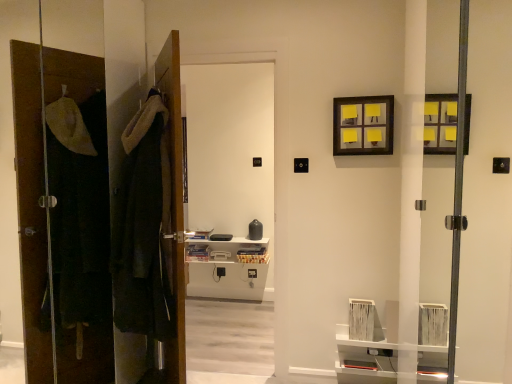
Question: Does velvet-like dark green robe at left have a lesser width compared to white glossy door at center?

Choices:
 (A) yes
 (B) no

Answer: (B)

Question: Can you confirm if velvet-like dark green robe at left is bigger than white glossy door at center?

Choices:
 (A) no
 (B) yes

Answer: (A)

Question: Would you say velvet-like dark green robe at left is outside white glossy door at center?

Choices:
 (A) no
 (B) yes

Answer: (B)

Question: From a real-world perspective, is velvet-like dark green robe at left under white glossy door at center?

Choices:
 (A) yes
 (B) no

Answer: (A)

Question: Considering the relative positions of velvet-like dark green robe at left and white glossy door at center in the image provided, is velvet-like dark green robe at left behind white glossy door at center?

Choices:
 (A) yes
 (B) no

Answer: (B)

Question: In terms of height, does brown wooden door at left, marked as the first door in a left-to-right arrangement, look taller or shorter compared to wooden door at center, marked as the 2th door in a left-to-right arrangement?

Choices:
 (A) short
 (B) tall

Answer: (B)

Question: Looking at the image, does brown wooden door at left, marked as the first door in a left-to-right arrangement, seem bigger or smaller compared to wooden door at center, acting as the 1th door starting from the right?

Choices:
 (A) small
 (B) big

Answer: (B)

Question: Which is correct: brown wooden door at left, which appears as the second door when viewed from the right, is inside wooden door at center, acting as the 1th door starting from the right, or outside of it?

Choices:
 (A) inside
 (B) outside

Answer: (B)

Question: Looking at their shapes, would you say brown wooden door at left, which appears as the second door when viewed from the right, is wider or thinner than wooden door at center, marked as the 2th door in a left-to-right arrangement?

Choices:
 (A) wide
 (B) thin

Answer: (B)

Question: From the image's perspective, is matte black picture frame at upper right above or below brown wooden door at left, marked as the first door in a left-to-right arrangement?

Choices:
 (A) above
 (B) below

Answer: (A)

Question: Visually, is matte black picture frame at upper right positioned to the left or to the right of brown wooden door at left, which appears as the second door when viewed from the right?

Choices:
 (A) left
 (B) right

Answer: (B)

Question: In the image, is matte black picture frame at upper right positioned in front of or behind brown wooden door at left, marked as the first door in a left-to-right arrangement?

Choices:
 (A) behind
 (B) front

Answer: (A)

Question: From a real-world perspective, is matte black picture frame at upper right positioned above or below brown wooden door at left, which appears as the second door when viewed from the right?

Choices:
 (A) below
 (B) above

Answer: (B)

Question: Is brown wooden door at left, which appears as the second door when viewed from the right, in front of or behind white glossy door at center in the image?

Choices:
 (A) behind
 (B) front

Answer: (B)

Question: From the image's perspective, is brown wooden door at left, which appears as the second door when viewed from the right, located above or below white glossy door at center?

Choices:
 (A) below
 (B) above

Answer: (B)